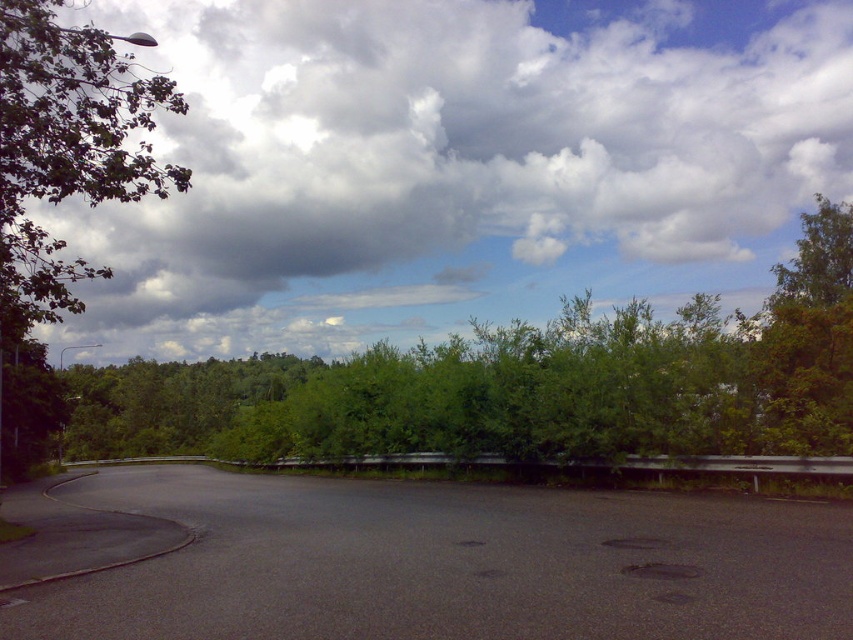
Who is higher up, black asphalt highway at center or green leafy tree at left?

green leafy tree at left is higher up.

Does black asphalt highway at center appear over green leafy tree at left?

No.

Is point (74, 483) less distant than point (114, 68)?

Yes, point (74, 483) is in front of point (114, 68).

Locate an element on the screen. black asphalt highway at center is located at coordinates (450, 563).

Can you confirm if cloudy sky at upper center is bigger than green leafy tree at center?

Correct, cloudy sky at upper center is larger in size than green leafy tree at center.

The image size is (853, 640). What are the coordinates of `cloudy sky at upper center` in the screenshot? It's located at (459, 163).

Between cloudy sky at upper center and green leafy tree at left, which one has less height?

green leafy tree at left is shorter.

Is cloudy sky at upper center further to the viewer compared to green leafy tree at left?

Yes, it is behind green leafy tree at left.

Who is more forward, (440,29) or (64,109)?

Point (64,109)

In order to click on cloudy sky at upper center in this screenshot , I will do `click(459, 163)`.